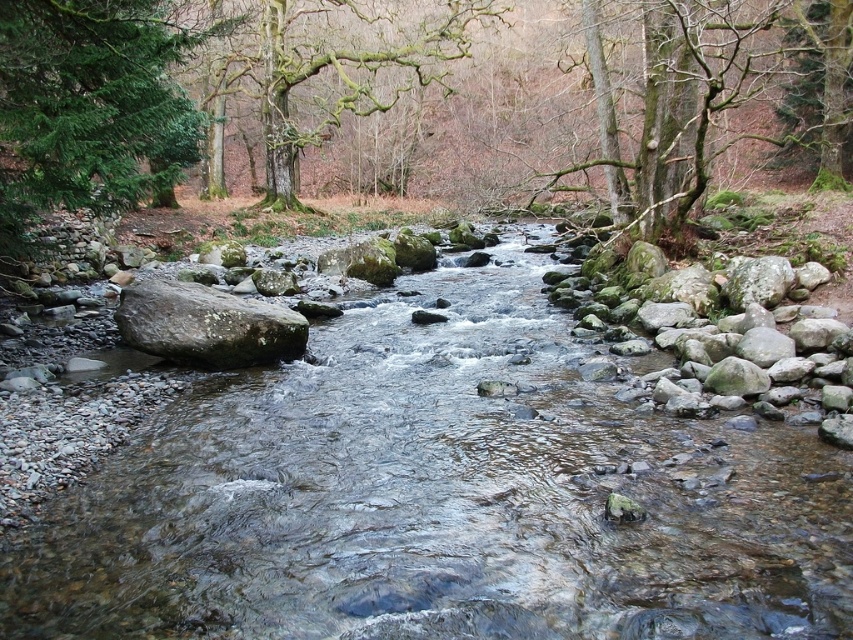
Is green mossy bark tree at upper right positioned in front of mossy bark tree at upper center?

Yes, it is in front of mossy bark tree at upper center.

Can you confirm if green mossy bark tree at upper right is positioned below mossy bark tree at upper center?

Correct, green mossy bark tree at upper right is located below mossy bark tree at upper center.

What do you see at coordinates (672, 112) in the screenshot?
I see `green mossy bark tree at upper right` at bounding box center [672, 112].

At what (x,y) coordinates should I click in order to perform the action: click on green mossy bark tree at upper right. Please return your answer as a coordinate pair (x, y). Looking at the image, I should click on click(672, 112).

Is mossy bark tree at upper center further to camera compared to green mossy tree at upper right?

Yes, mossy bark tree at upper center is behind green mossy tree at upper right.

The image size is (853, 640). In order to click on mossy bark tree at upper center in this screenshot , I will do `click(331, 70)`.

Where is `mossy bark tree at upper center`? This screenshot has width=853, height=640. mossy bark tree at upper center is located at coordinates (331, 70).

This screenshot has width=853, height=640. I want to click on mossy bark tree at upper center, so click(331, 70).

You are a GUI agent. You are given a task and a screenshot of the screen. Output one action in this format:
    pyautogui.click(x=<x>, y=<y>)
    Task: Click on the mossy bark tree at upper center
    The height and width of the screenshot is (640, 853).
    Given the screenshot: What is the action you would take?
    pyautogui.click(x=331, y=70)